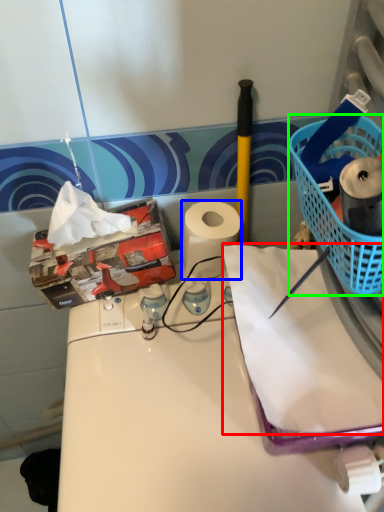
Question: Considering the real-world distances, which object is closest to paper (highlighted by a red box)? paper towel (highlighted by a blue box) or basket (highlighted by a green box).

Choices:
 (A) paper towel
 (B) basket

Answer: (B)